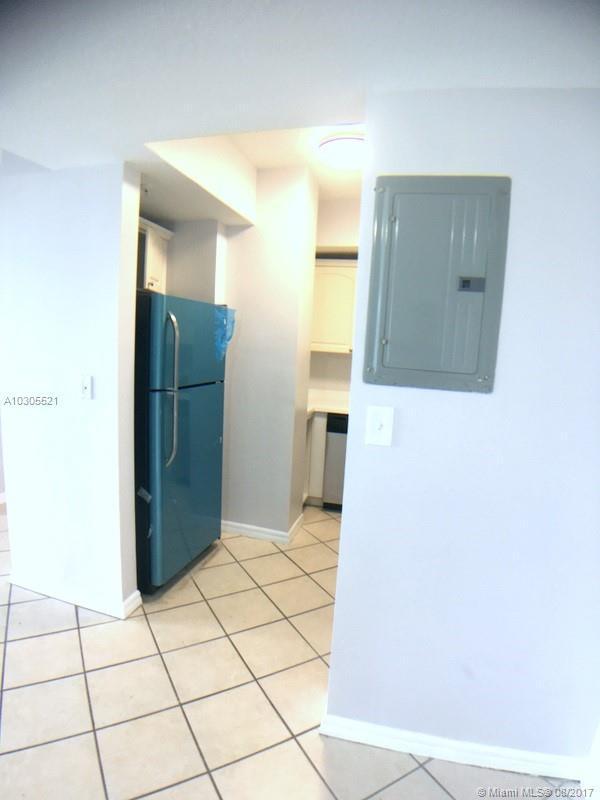
Find the location of a particular element. white walls is located at coordinates (446, 521), (74, 248), (273, 265), (197, 245), (172, 198), (340, 214).